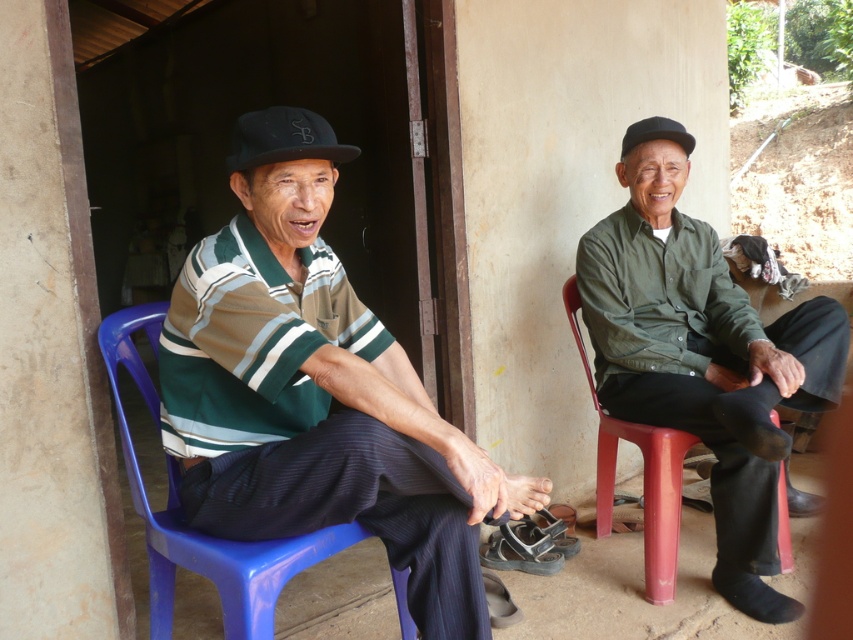
You are standing at the origin point of the coordinate system in the image. You want to move towards the red plastic chair at right. What direction should you move in to reach it?

You should move towards the coordinates point (643, 476) to reach the red plastic chair at right.